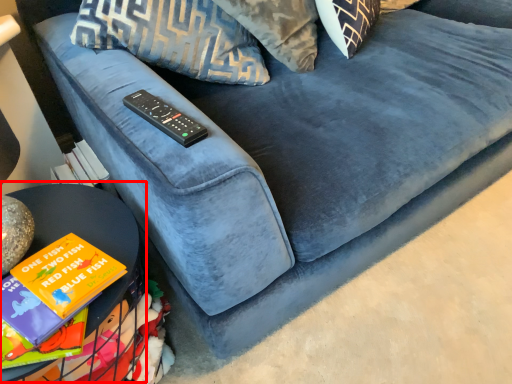
Question: From the image, what is the correct spatial relationship of table (annotated by the red box) in relation to remote?

Choices:
 (A) right
 (B) left

Answer: (B)